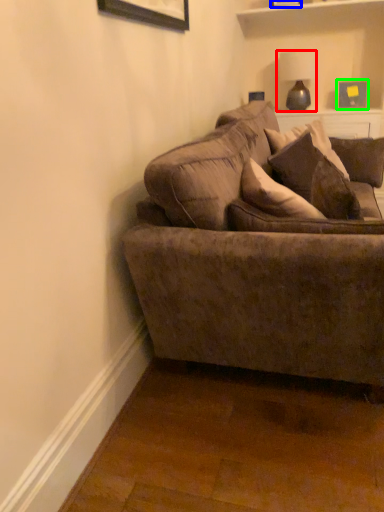
Question: Considering the real-world distances, which object is farthest from lamp (highlighted by a red box)? picture frame (highlighted by a blue box) or picture frame (highlighted by a green box)?

Choices:
 (A) picture frame
 (B) picture frame

Answer: (A)